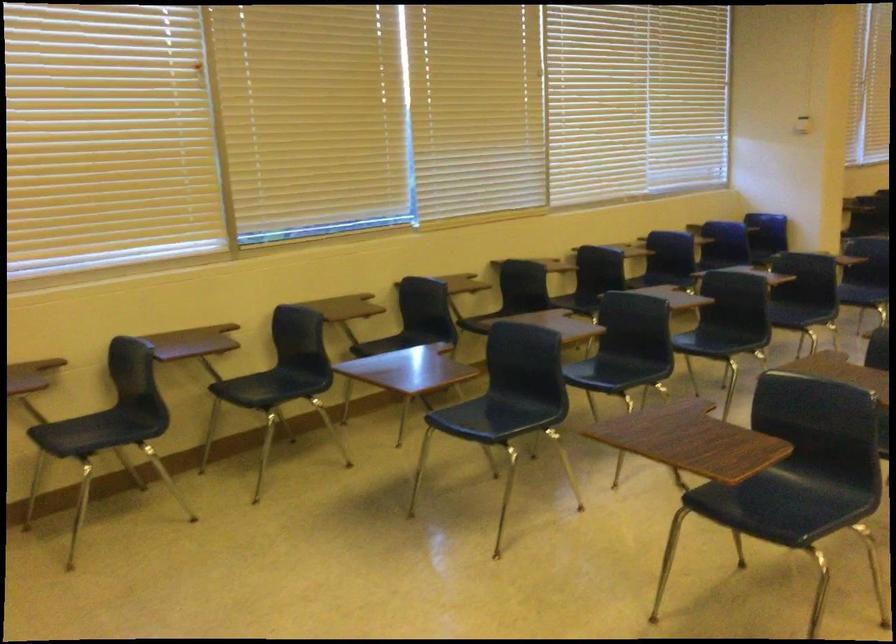
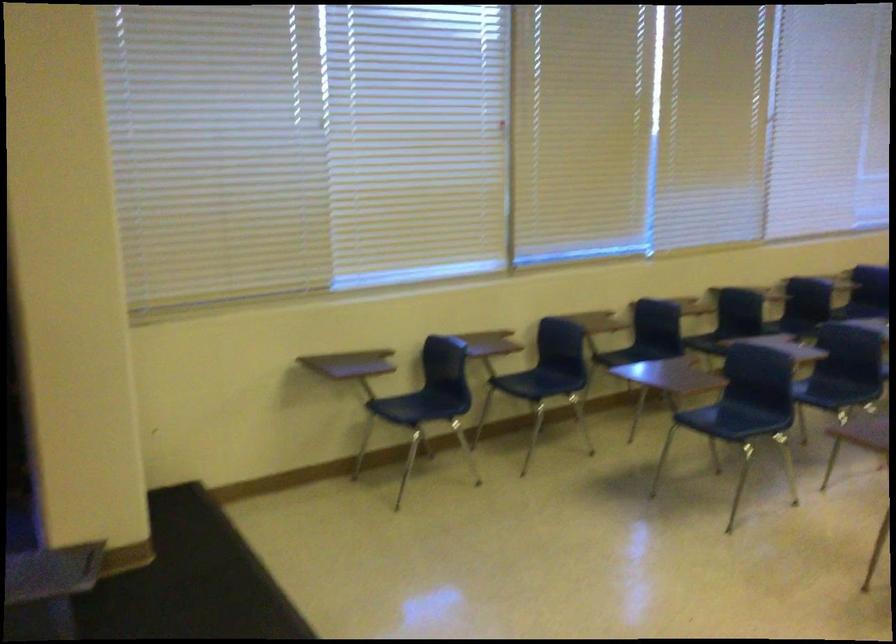
In the second image, find the point that corresponds to (x=407, y=77) in the first image.

(653, 134)